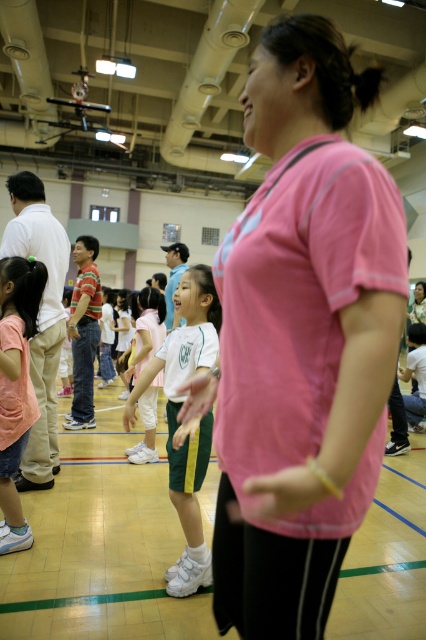
Which is above, pink fabric shirt at center or white matte uniform at center?

pink fabric shirt at center

Who is more distant from viewer, (268, 72) or (181, 509)?

Positioned behind is point (181, 509).

Describe the element at coordinates (301, 339) in the screenshot. I see `pink fabric shirt at center` at that location.

The image size is (426, 640). I want to click on pink fabric shirt at center, so click(301, 339).

Who is taller, matte white shirt at left or white matte shorts at center?

Standing taller between the two is matte white shirt at left.

What are the coordinates of `matte white shirt at left` in the screenshot? It's located at point(40,317).

Describe the element at coordinates (40, 317) in the screenshot. I see `matte white shirt at left` at that location.

Which is more to the right, matte white shirt at left or pink matte shirt at lower left?

pink matte shirt at lower left

Is point (55, 314) closer to camera compared to point (11, 435)?

No, (55, 314) is behind (11, 435).

At what (x,y) coordinates should I click in order to perform the action: click on matte white shirt at left. Please return your answer as a coordinate pair (x, y). Looking at the image, I should click on (40, 317).